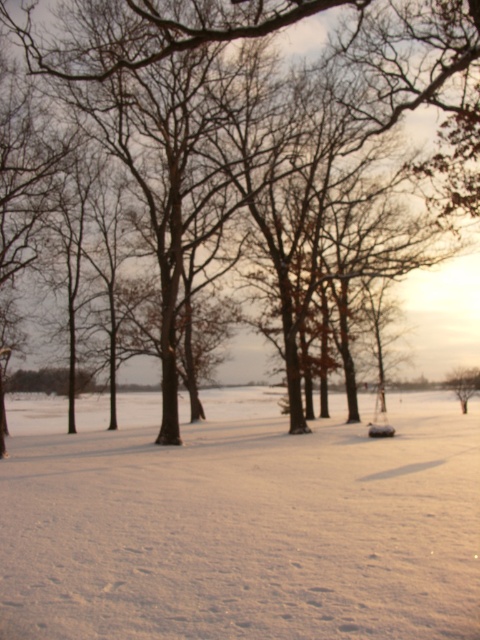
Question: Is white powdery snow at center in front of brown bark tree at center?

Choices:
 (A) no
 (B) yes

Answer: (B)

Question: Among these objects, which one is farthest from the camera?

Choices:
 (A) brown bark tree at center
 (B) white powdery snow at center

Answer: (A)

Question: Which object is farther from the camera taking this photo?

Choices:
 (A) brown bark tree at center
 (B) white powdery snow at center

Answer: (A)

Question: Is white powdery snow at center thinner than brown bark tree at center?

Choices:
 (A) no
 (B) yes

Answer: (A)

Question: Which point is farther to the camera?

Choices:
 (A) (71, 541)
 (B) (397, 81)

Answer: (B)

Question: Does white powdery snow at center have a lesser width compared to brown bark tree at center?

Choices:
 (A) yes
 (B) no

Answer: (B)